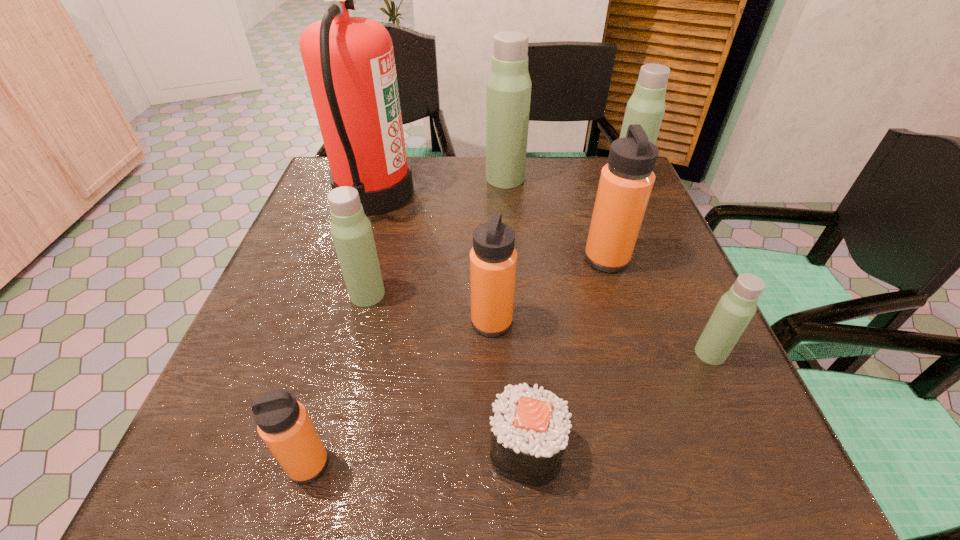
Where is `free area in between the second nearest light thermos bottle and the nearest orange thermos bottle`? The image size is (960, 540). free area in between the second nearest light thermos bottle and the nearest orange thermos bottle is located at coordinates (x=338, y=379).

The image size is (960, 540). What are the coordinates of `free space between the shortest object and the second smallest light thermos bottle` in the screenshot? It's located at (446, 372).

Where is `empty space that is in between the nearest orange thermos bottle and the shortest object`? Image resolution: width=960 pixels, height=540 pixels. empty space that is in between the nearest orange thermos bottle and the shortest object is located at coordinates (417, 456).

Locate an element on the screen. vacant point located between the third smallest light thermos bottle and the smallest orange thermos bottle is located at coordinates (468, 323).

The image size is (960, 540). What are the coordinates of `free space between the second biggest light thermos bottle and the sushi` in the screenshot? It's located at (576, 316).

Identify which object is located as the fifth nearest to the tallest object. Please provide its 2D coordinates. Your answer should be formatted as a tuple, i.e. [(x, y)], where the tuple contains the x and y coordinates of a point satisfying the conditions above.

[(530, 427)]

Identify which object is the fifth closest to the third smallest light thermos bottle. Please provide its 2D coordinates. Your answer should be formatted as a tuple, i.e. [(x, y)], where the tuple contains the x and y coordinates of a point satisfying the conditions above.

[(349, 62)]

Locate which thermos bottle is the second closest to the second biggest light thermos bottle. Please provide its 2D coordinates. Your answer should be formatted as a tuple, i.e. [(x, y)], where the tuple contains the x and y coordinates of a point satisfying the conditions above.

[(509, 85)]

Locate which thermos bottle is the second closest to the seventh farthest object. Please provide its 2D coordinates. Your answer should be formatted as a tuple, i.e. [(x, y)], where the tuple contains the x and y coordinates of a point satisfying the conditions above.

[(493, 259)]

Locate which light thermos bottle is the fourth closest to the shortest object. Please provide its 2D coordinates. Your answer should be formatted as a tuple, i.e. [(x, y)], where the tuple contains the x and y coordinates of a point satisfying the conditions above.

[(646, 107)]